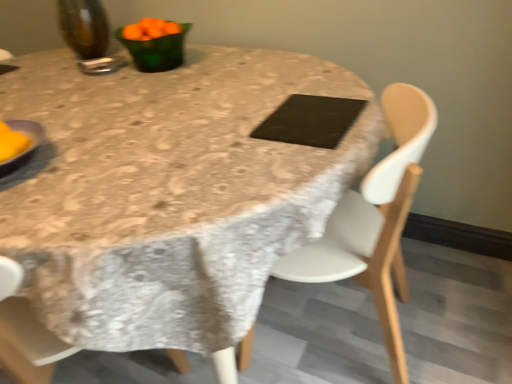
This screenshot has height=384, width=512. What are the coordinates of `vacant area to the right of green glass bowl at upper left, the 2th tableware when ordered from left to right` in the screenshot? It's located at (227, 58).